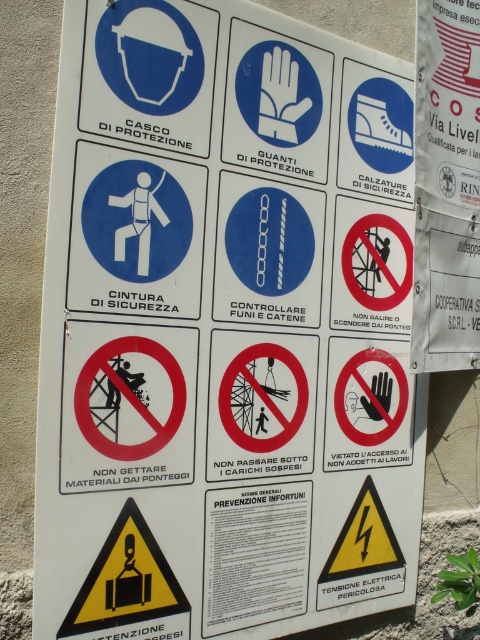
You are an inspector checking the safety signs. The red circle sign at center and the blue matte safety harness at center are both on the same wall. Which one is taller?

The red circle sign at center is taller than the blue matte safety harness at center.

You are an inspector checking the safety equipment on the signboard. The blue matte safety harness at center and the blue glossy chain at center are both displayed. Which one appears wider in the image?

The blue matte safety harness at center is wider than the blue glossy chain at center according to the description.